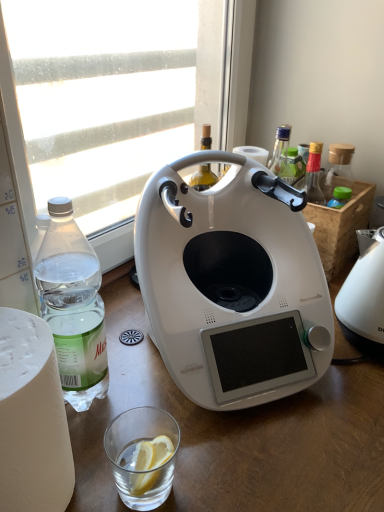
Question: From the image's perspective, is clear glass at lower center above or below white glossy coffee maker at center, which is counted as the first kitchen appliance, starting from the left?

Choices:
 (A) below
 (B) above

Answer: (A)

Question: From a real-world perspective, relative to white glossy coffee maker at center, which is the second kitchen appliance in right-to-left order, is clear glass at lower center vertically above or below?

Choices:
 (A) above
 (B) below

Answer: (B)

Question: Which is farther from the white plastic kettle at right, placed as the 2th kitchen appliance when sorted from left to right?

Choices:
 (A) clear glass at lower center
 (B) transparent glass window at upper left
 (C) white glossy coffee maker at center, which is the second kitchen appliance in right-to-left order
 (D) clear plastic bottle at left

Answer: (B)

Question: Estimate the real-world distances between objects in this image. Which object is farther from the white plastic kettle at right, the first kitchen appliance positioned from the right?

Choices:
 (A) transparent glass window at upper left
 (B) clear glass at lower center
 (C) white glossy coffee maker at center, which is counted as the first kitchen appliance, starting from the left
 (D) clear plastic bottle at left

Answer: (A)